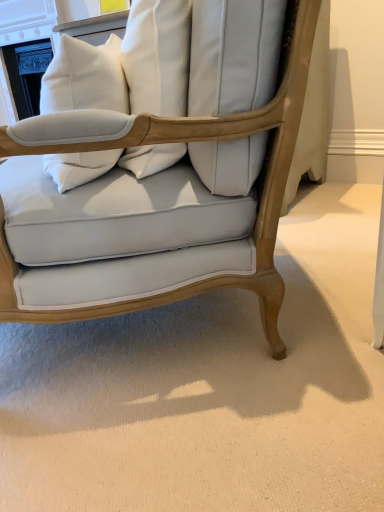
The image size is (384, 512). What do you see at coordinates (203, 139) in the screenshot?
I see `light beige wood chair at center` at bounding box center [203, 139].

Measure the distance between point (95, 313) and camera.

Point (95, 313) is 32.80 inches away from camera.

You are a GUI agent. You are given a task and a screenshot of the screen. Output one action in this format:
    pyautogui.click(x=<x>, y=<y>)
    Task: Click on the light beige wood chair at center
    
    Given the screenshot: What is the action you would take?
    pyautogui.click(x=203, y=139)

Where is `light beige wood chair at center`? light beige wood chair at center is located at coordinates (203, 139).